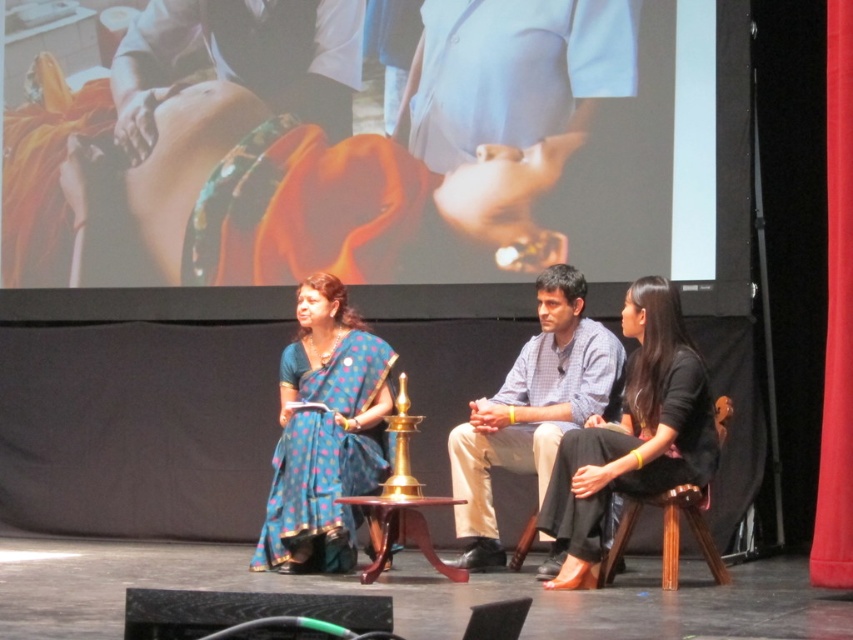
Question: Is blue polka dot sari at center positioned behind brown wooden stool at lower right?

Choices:
 (A) yes
 (B) no

Answer: (A)

Question: Can you confirm if black matte dress at center is positioned below mahogany wood stool at center?

Choices:
 (A) no
 (B) yes

Answer: (A)

Question: Among these objects, which one is nearest to the camera?

Choices:
 (A) red fabric curtain at right
 (B) mahogany wood stool at center

Answer: (A)

Question: Which object is the farthest from the red fabric curtain at right?

Choices:
 (A) mahogany wood stool at center
 (B) light blue checkered shirt at center

Answer: (A)

Question: Which is farther from the blue polka dot sari at center?

Choices:
 (A) red fabric curtain at right
 (B) light blue checkered shirt at center

Answer: (A)

Question: Where is blue polka dot sari at center located in relation to mahogany wood stool at center in the image?

Choices:
 (A) left
 (B) right

Answer: (A)